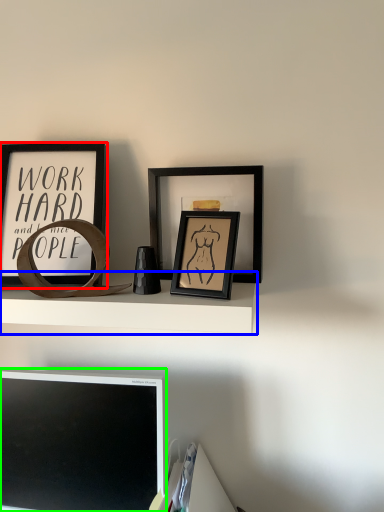
Question: Based on their relative distances, which object is nearer to picture frame (highlighted by a red box)? Choose from shelf (highlighted by a blue box) and computer monitor (highlighted by a green box).

Choices:
 (A) shelf
 (B) computer monitor

Answer: (A)